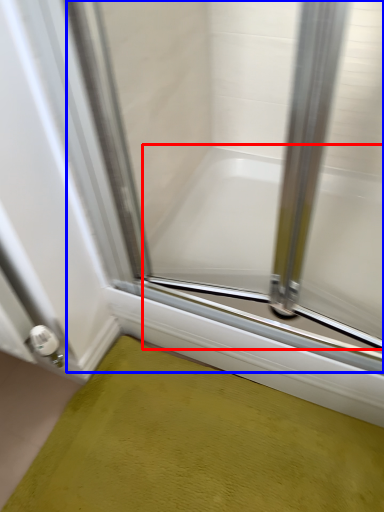
Question: Which point is closer to the camera, bathtub (highlighted by a red box) or glass door (highlighted by a blue box)?

Choices:
 (A) bathtub
 (B) glass door

Answer: (B)